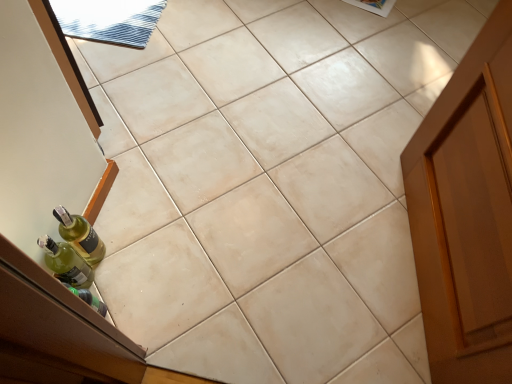
Locate an element on the screen. The width and height of the screenshot is (512, 384). unoccupied space behind green glass bottle at lower left, which is counted as the second bottle, starting from the bottom is located at coordinates (125, 212).